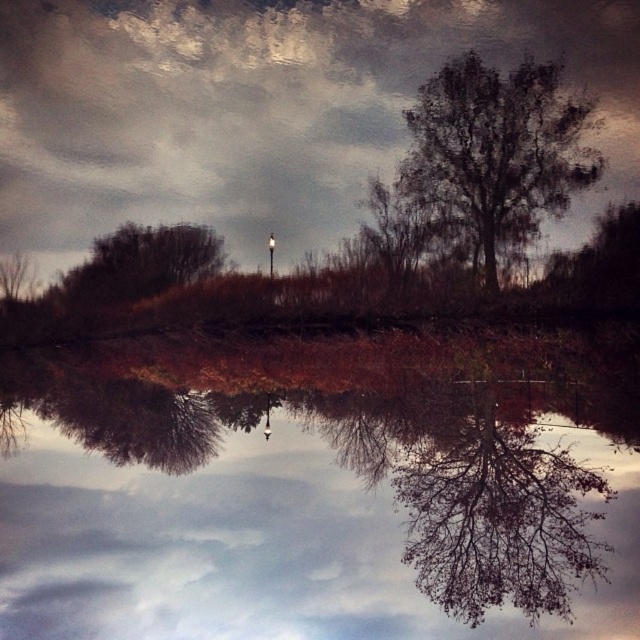
You are standing at point A with coordinates point A at (572, 163). You want to walk to point B, which is 34.93 meters away. Is there a direct path between them, or will you have to go around any obstacles?

There is a direct path between point A at (572, 163) and point B since the scene description mentions a calm body of water with a reflective surface and no obstacles blocking the path. The distance of 34.93 meters can be covered directly without needing to detour around any obstructions.